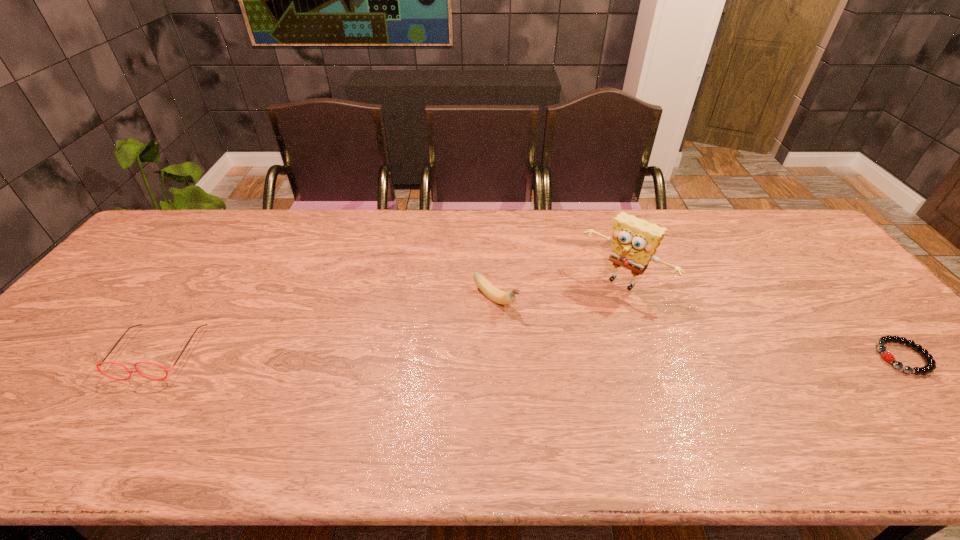
I want to click on free space located 0.060m on the face of the sponge, so click(x=591, y=314).

Identify the location of blank space located 0.060m on the face of the sponge. This screenshot has width=960, height=540. (591, 314).

Find the location of a particular element. vacant area situated on the face of the sponge is located at coordinates pyautogui.click(x=560, y=350).

I want to click on blank area located 0.280m at the stem of the second object from left to right, so click(595, 376).

Locate an element on the screen. This screenshot has height=540, width=960. free location located 0.070m at the stem of the second object from left to right is located at coordinates (531, 327).

Find the location of a particular element. Image resolution: width=960 pixels, height=540 pixels. vacant position located 0.130m at the stem of the second object from left to right is located at coordinates point(548,340).

Locate an element on the screen. The height and width of the screenshot is (540, 960). object situated at the right edge is located at coordinates (930, 365).

Identify the location of free spot at the far edge of the desktop. The height and width of the screenshot is (540, 960). (490, 230).

Image resolution: width=960 pixels, height=540 pixels. In order to click on vacant area at the near edge of the desktop in this screenshot , I will do `click(871, 398)`.

Locate an element on the screen. This screenshot has width=960, height=540. free space at the left edge of the desktop is located at coordinates (106, 296).